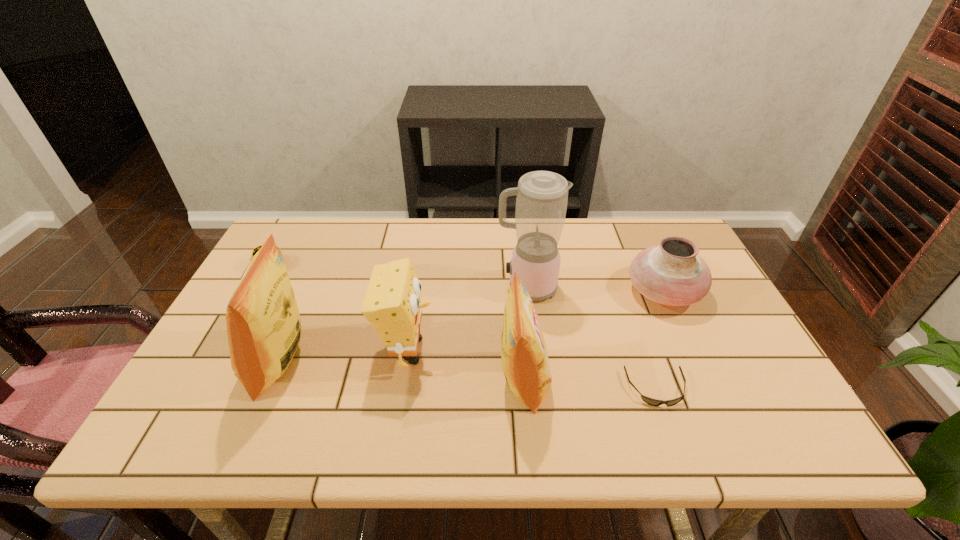
Identify the location of vacant region at the far left corner of the desktop. (323, 221).

Identify the location of free spot between the pottery and the second shortest object. (467, 279).

Locate an element on the screen. Image resolution: width=960 pixels, height=540 pixels. vacant space that's between the patty and the third shortest object is located at coordinates (467, 279).

You are a GUI agent. You are given a task and a screenshot of the screen. Output one action in this format:
    pyautogui.click(x=<x>, y=<y>)
    Task: Click on the free space between the pottery and the food processor
    This screenshot has height=540, width=960.
    Given the screenshot: What is the action you would take?
    pyautogui.click(x=595, y=289)

Locate an element on the screen. The image size is (960, 540). vacant region between the sponge and the food processor is located at coordinates (468, 319).

Find the location of a particular element. unoccupied position between the second tallest object and the shorter crisp (potato chip) is located at coordinates (401, 371).

The width and height of the screenshot is (960, 540). Identify the location of free space that is in between the sponge and the patty. (340, 308).

Identify which object is the fifth nearest to the sponge. Please provide its 2D coordinates. Your answer should be formatted as a tuple, i.e. [(x, y)], where the tuple contains the x and y coordinates of a point satisfying the conditions above.

[(653, 402)]

At what (x,y) coordinates should I click in order to perform the action: click on the fifth closest object to the sixth shortest object. Please return your answer as a coordinate pair (x, y). The width and height of the screenshot is (960, 540). Looking at the image, I should click on (653, 402).

This screenshot has height=540, width=960. What are the coordinates of `free space in the image that satisfies the following two spatial constraints: 1. on the back side of the third shortest object; 2. on the base of the food processor near the control knob` in the screenshot? It's located at (661, 288).